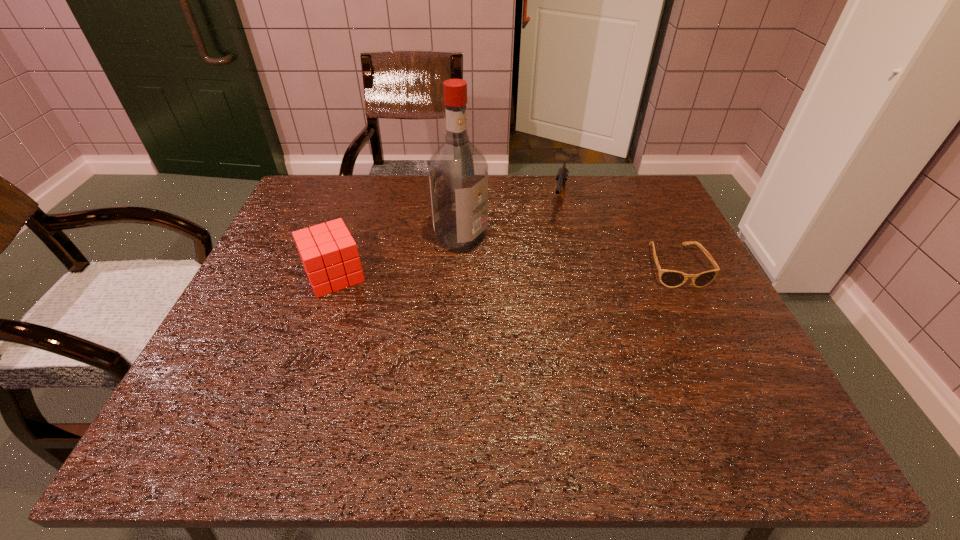
The image size is (960, 540). Find the location of `the leftmost object`. the leftmost object is located at coordinates (329, 254).

Locate an element on the screen. The width and height of the screenshot is (960, 540). the shortest object is located at coordinates (670, 278).

Identify the location of sunglasses. This screenshot has height=540, width=960. (670, 278).

Find the location of `the tallest object`. the tallest object is located at coordinates (458, 172).

This screenshot has width=960, height=540. In order to click on the second object from left to right in this screenshot , I will do `click(458, 172)`.

Where is `the third object from left to right`? Image resolution: width=960 pixels, height=540 pixels. the third object from left to right is located at coordinates (562, 174).

Find the location of a particular element. The image size is (960, 540). free space located on the left of the leftmost object is located at coordinates (262, 275).

Find the location of `free space located 0.110m on the front-facing side of the shortest object`. free space located 0.110m on the front-facing side of the shortest object is located at coordinates (703, 324).

The height and width of the screenshot is (540, 960). What are the coordinates of `vacant space located on the front-facing side of the liquor` in the screenshot? It's located at (540, 271).

I want to click on vacant space located 0.310m on the front-facing side of the liquor, so click(x=592, y=293).